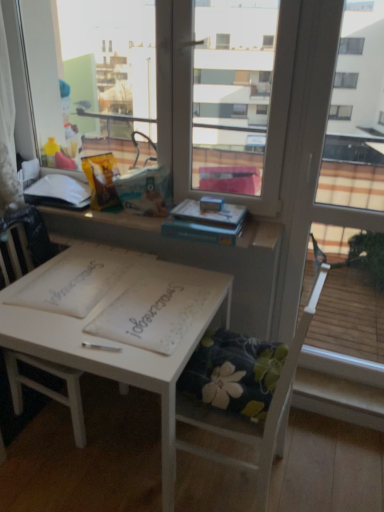
Locate an element on the screen. The height and width of the screenshot is (512, 384). free location above white paper notebook at center, the 1th notebook in the left-to-right sequence (from a real-world perspective) is located at coordinates (86, 283).